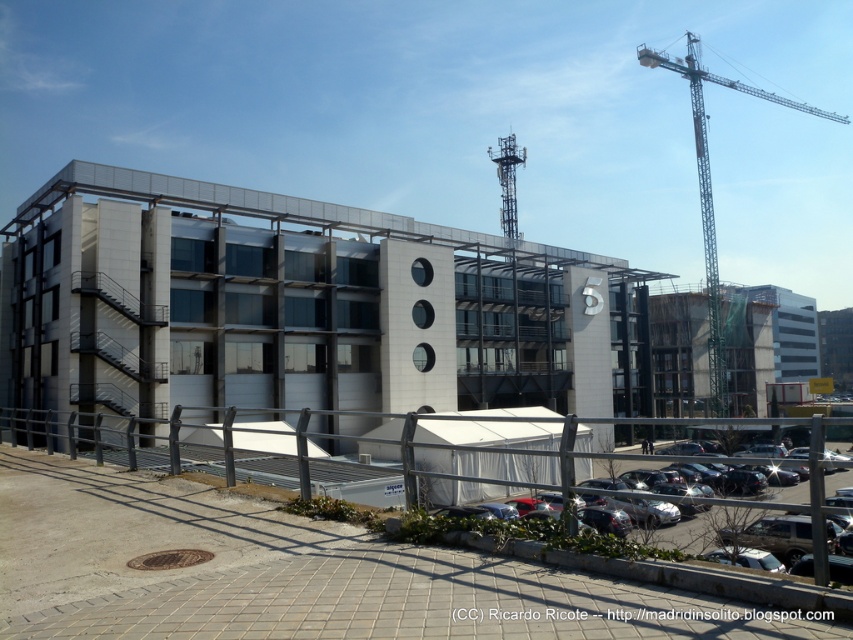
Question: In this image, where is white tent at center located relative to black asphalt parking lot at lower right?

Choices:
 (A) right
 (B) left

Answer: (B)

Question: Based on their relative distances, which object is nearer to the white tent at center?

Choices:
 (A) green metallic crane at upper right
 (B) black asphalt parking lot at lower right

Answer: (B)

Question: Is white tent at center bigger than green metallic crane at upper right?

Choices:
 (A) no
 (B) yes

Answer: (A)

Question: Which object is the farthest from the black asphalt parking lot at lower right?

Choices:
 (A) green metallic crane at upper right
 (B) white tent at center

Answer: (A)

Question: Can you confirm if green metallic crane at upper right is bigger than black asphalt parking lot at lower right?

Choices:
 (A) no
 (B) yes

Answer: (B)

Question: Among these points, which one is nearest to the camera?

Choices:
 (A) (709, 288)
 (B) (782, 552)

Answer: (B)